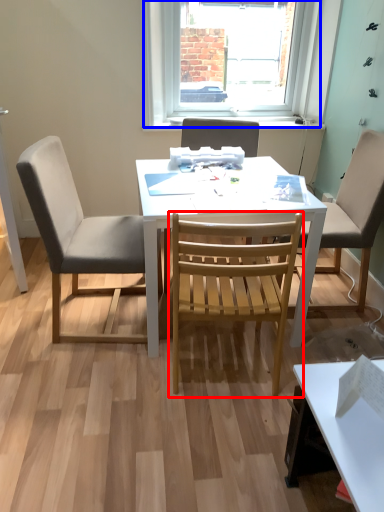
Question: Among these objects, which one is nearest to the camera, chair (highlighted by a red box) or window (highlighted by a blue box)?

Choices:
 (A) chair
 (B) window

Answer: (A)